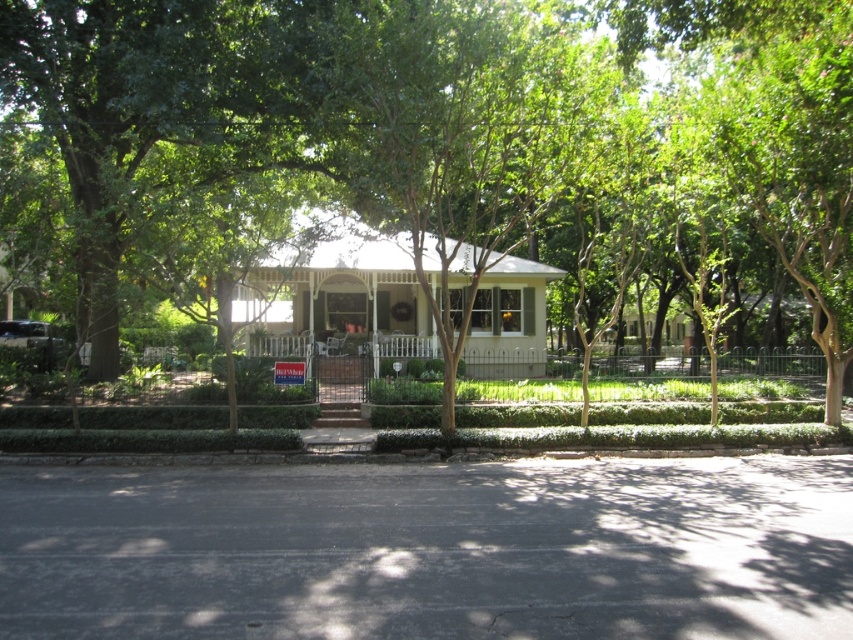
You are standing at the entrance of the house. You want to walk straight ahead towards the beige textured gazebo at center. Will you need to walk through any trees or shrubs along the way?

The beige textured gazebo at center is located at point (340, 296). Since the gazebo is at the center of the scene, and the property has trees and shrubs surrounding the house but the lawn in front is well maintained with neatly trimmed grass and small bushes arranged along, it is possible that the path to the gazebo is clear of dense vegetation. However, without specific information about the exact placement of trees and shrubs between the entrance and the gazebo, it is uncertain if there are obstacles.

You are standing on the front porch of the house and looking towards the center of the image. Which object, the green leafy tree at center or the white matte roof at center, is positioned higher in the scene?

The green leafy tree at center is positioned higher than the white matte roof at center in the scene.

You are standing in front of the house and want to know if the green leafy tree at center will block the view of the white matte roof at center. Based on their heights, can you determine if the tree is taller than the roof?

The green leafy tree at center is taller than the white matte roof at center, so yes, the tree is taller than the roof.